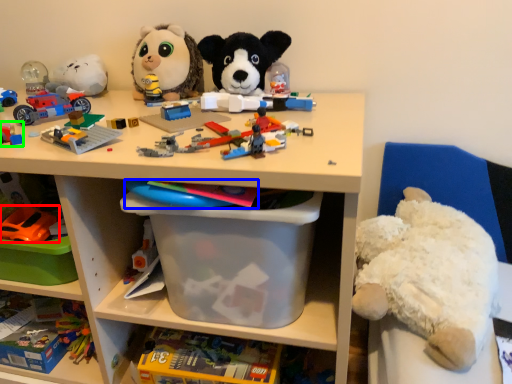
Question: Which object is positioned closest to toy (highlighted by a red box)? Select from toy (highlighted by a blue box) and toy (highlighted by a green box).

Choices:
 (A) toy
 (B) toy

Answer: (B)